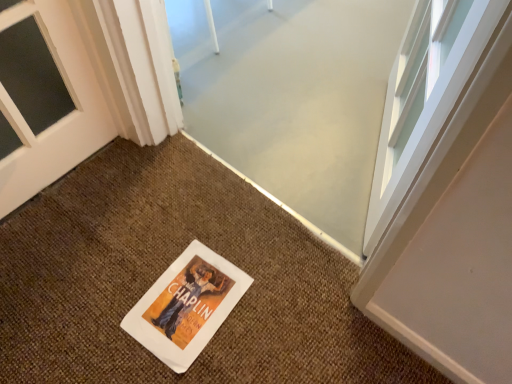
Locate an element on the screen. free point behind white paper flyer at center is located at coordinates (196, 221).